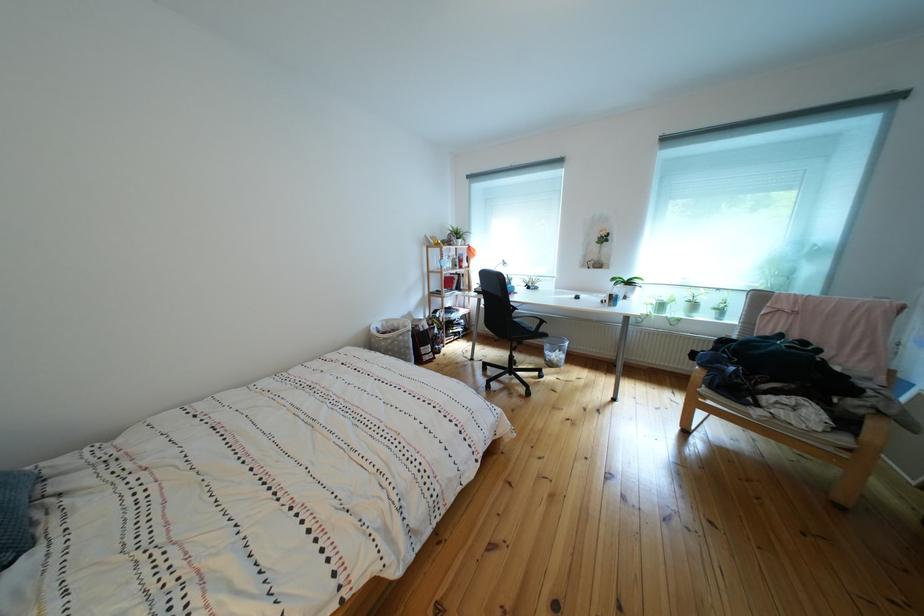
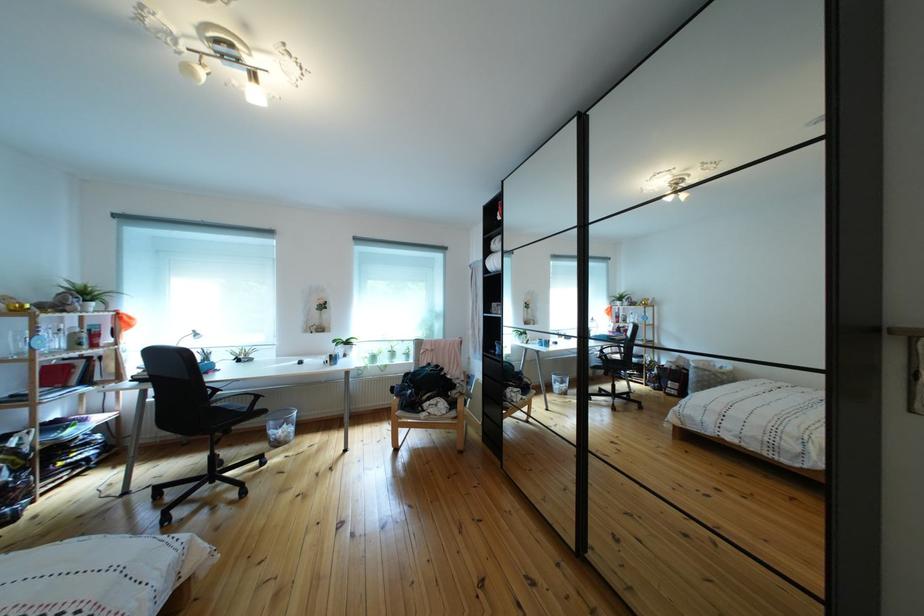
Find the pixel in the second image that matches point (526, 314) in the first image.

(227, 395)